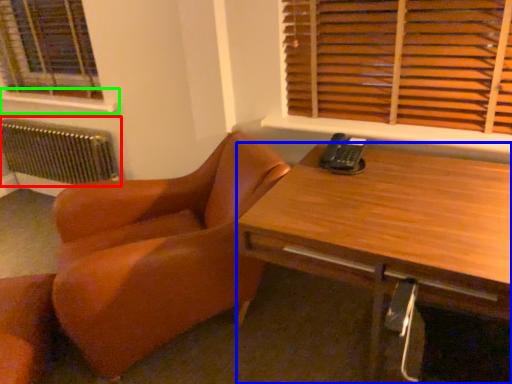
Question: Estimate the real-world distances between objects in this image. Which object is closer to radiator (highlighted by a red box), desk (highlighted by a blue box) or window sill (highlighted by a green box)?

Choices:
 (A) desk
 (B) window sill

Answer: (B)